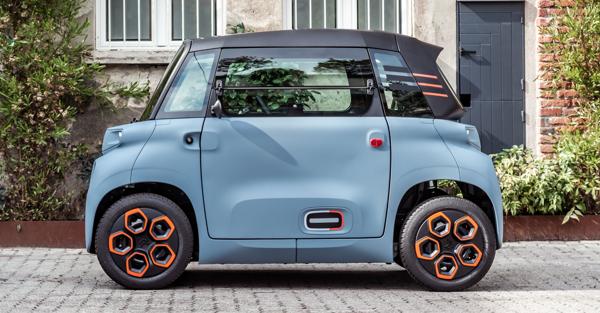
This screenshot has height=313, width=600. In order to click on window in this screenshot , I will do `click(122, 14)`, `click(201, 22)`, `click(302, 93)`.